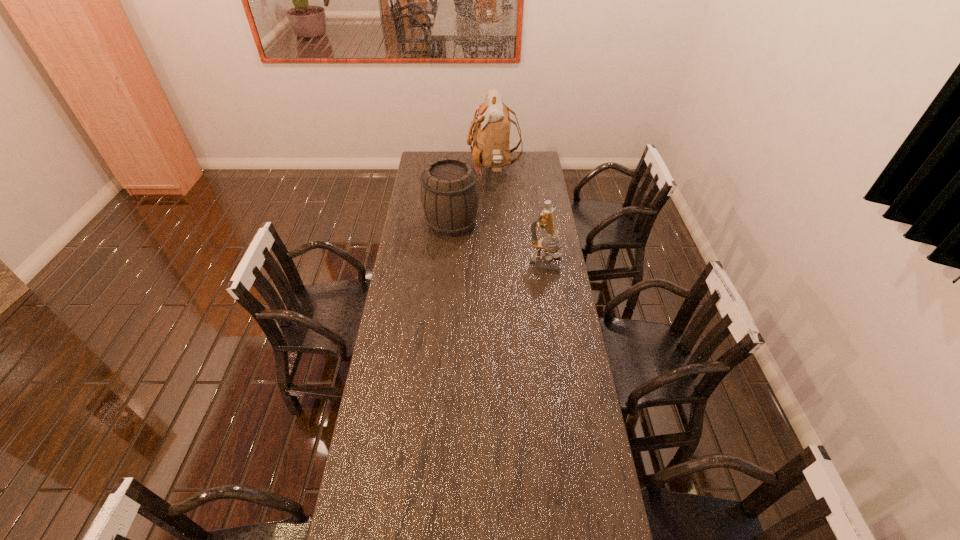
Identify the location of object that is positioned at the left edge. The height and width of the screenshot is (540, 960). (450, 196).

Where is `backpack positioned at the right edge`? backpack positioned at the right edge is located at coordinates click(x=491, y=133).

This screenshot has height=540, width=960. I want to click on microscope that is at the right edge, so click(x=546, y=220).

You are a GUI agent. You are given a task and a screenshot of the screen. Output one action in this format:
    pyautogui.click(x=<x>, y=<y>)
    Task: Click on the object at the far right corner
    The width and height of the screenshot is (960, 540).
    Given the screenshot: What is the action you would take?
    pyautogui.click(x=491, y=133)

Identify the location of vacant space at the far edge. This screenshot has width=960, height=540. (445, 157).

The image size is (960, 540). In the image, there is a desktop. Find the location of `vacant space at the left edge`. vacant space at the left edge is located at coordinates (418, 335).

Locate an element on the screen. vacant space at the right edge is located at coordinates (523, 222).

Find the location of a particular element. blank space at the far right corner of the desktop is located at coordinates (519, 162).

What are the coordinates of `vacant point located between the tallest object and the nearest object` in the screenshot? It's located at (519, 217).

The image size is (960, 540). Identify the location of free spot between the nearest object and the second farthest object. (498, 244).